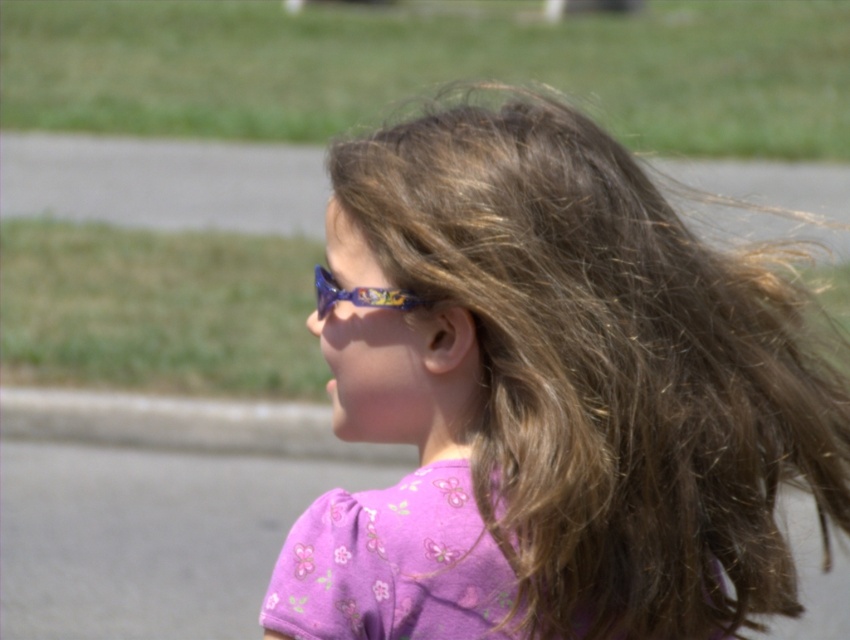
Can you confirm if purple fabric shirt at center is wider than shiny blue plastic goggles at center?

Correct, the width of purple fabric shirt at center exceeds that of shiny blue plastic goggles at center.

Who is taller, purple fabric shirt at center or shiny blue plastic goggles at center?

Standing taller between the two is purple fabric shirt at center.

Is point (769, 406) more distant than point (316, 280)?

No, it is not.

Find the location of `purple fabric shirt at center`. purple fabric shirt at center is located at coordinates (553, 397).